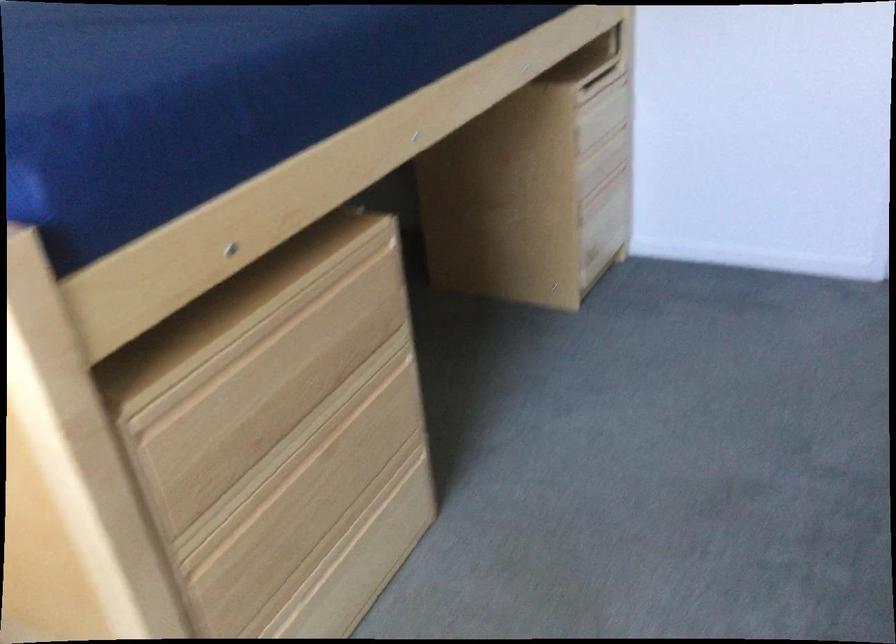
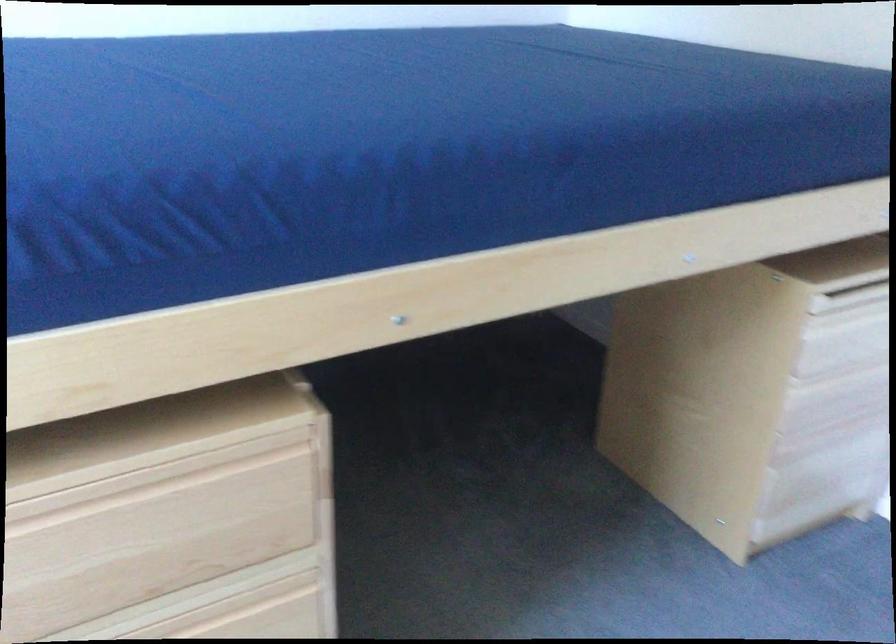
Question: Based on the continuous images, in which direction is the camera rotating? Reply with the corresponding letter.

Choices:
 (A) Left
 (B) Right
 (C) Up
 (D) Down

Answer: (A)